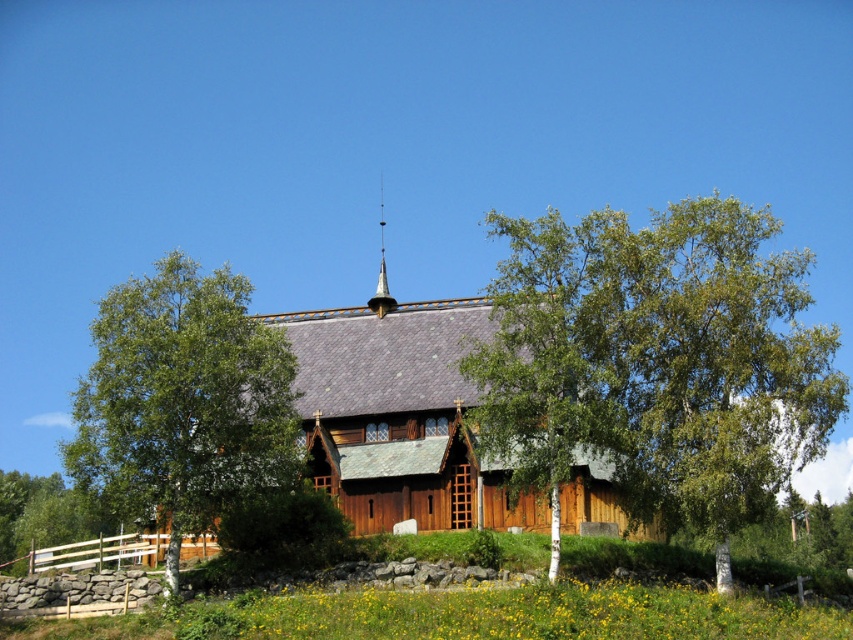
Does green leafy tree at left appear on the right side of shiny gold spire at center top?

In fact, green leafy tree at left is to the left of shiny gold spire at center top.

Between green leafy tree at left and shiny gold spire at center top, which one appears on the right side from the viewer's perspective?

From the viewer's perspective, shiny gold spire at center top appears more on the right side.

Is point (183, 433) farther from viewer compared to point (381, 232)?

No, it is not.

Locate an element on the screen. green leafy tree at left is located at coordinates (183, 401).

Is point (151, 518) positioned behind point (579, 509)?

No, (151, 518) is closer to viewer.

Between point (85, 394) and point (523, 506), which one is positioned in front?

Point (85, 394) is in front.

Locate an element on the screen. The width and height of the screenshot is (853, 640). green leafy tree at left is located at coordinates (183, 401).

Which of these two, green leafy tree at center or wooden church at center, stands shorter?

wooden church at center is shorter.

Where is `green leafy tree at center`? green leafy tree at center is located at coordinates (656, 362).